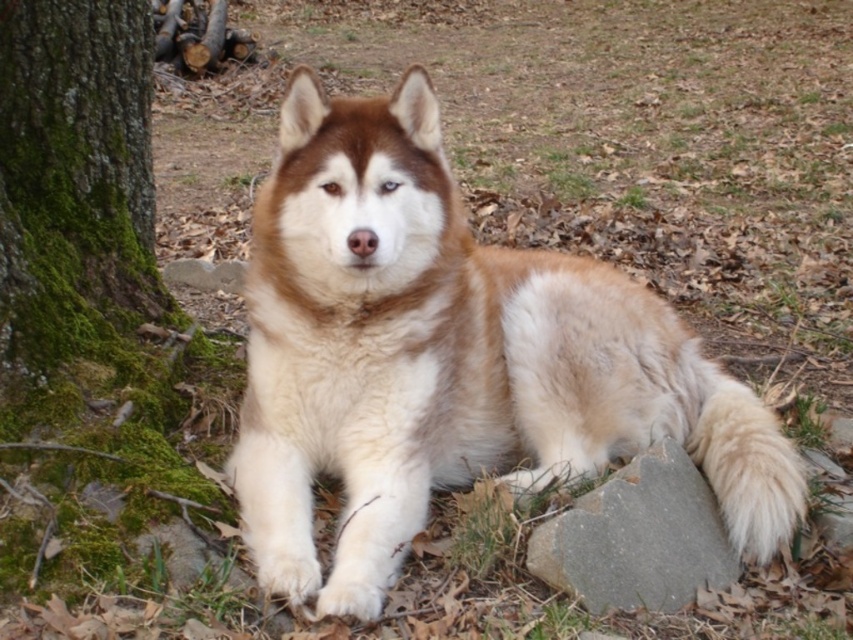
Question: Where is brown and white fur dog at center located in relation to green mossy bark at left in the image?

Choices:
 (A) above
 (B) below

Answer: (B)

Question: Estimate the real-world distances between objects in this image. Which object is farther from the brown and white fur dog at center?

Choices:
 (A) gray smooth rock at lower right
 (B) green mossy bark at left

Answer: (B)

Question: Which point is closer to the camera?

Choices:
 (A) coord(120,256)
 (B) coord(576,509)

Answer: (B)

Question: Does brown and white fur dog at center have a greater width compared to green mossy bark at left?

Choices:
 (A) yes
 (B) no

Answer: (A)

Question: Which object is closer to the camera taking this photo?

Choices:
 (A) green mossy bark at left
 (B) gray smooth rock at lower right

Answer: (B)

Question: Does green mossy bark at left lie in front of gray smooth rock at lower right?

Choices:
 (A) yes
 (B) no

Answer: (B)